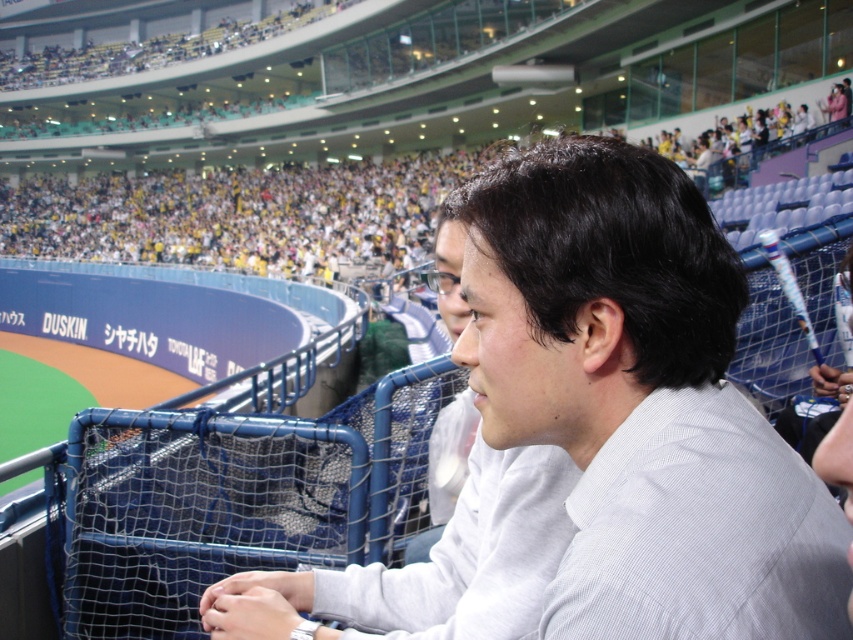
Is point (601, 444) more distant than point (521, 588)?

That is False.

Is white textured shirt at center shorter than white cotton shirt at center?

No, white textured shirt at center is not shorter than white cotton shirt at center.

Does point (602, 417) lie behind point (306, 609)?

That is False.

Find the location of a particular element. white textured shirt at center is located at coordinates (639, 401).